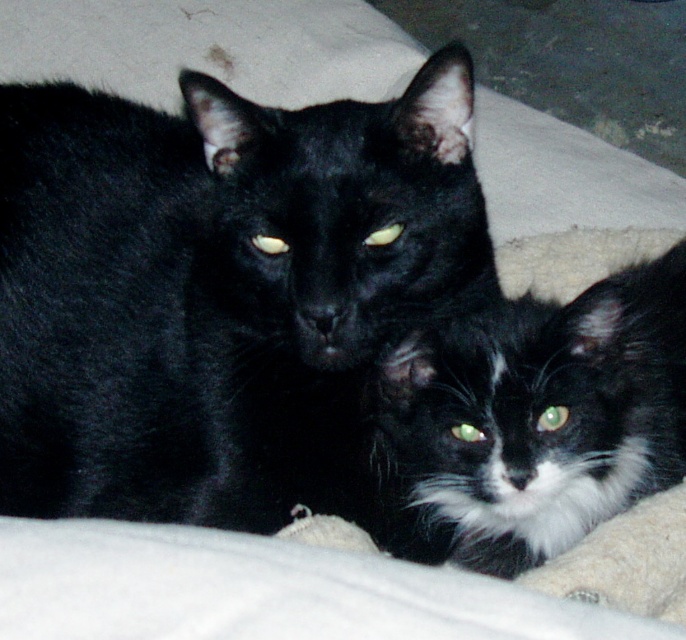
Question: Does black fur cat at center have a lesser width compared to black fluffy cat at center?

Choices:
 (A) yes
 (B) no

Answer: (B)

Question: Which point appears closest to the camera in this image?

Choices:
 (A) (670, 476)
 (B) (189, 490)

Answer: (B)

Question: Which point appears farthest from the camera in this image?

Choices:
 (A) (606, 458)
 (B) (36, 369)

Answer: (B)

Question: Is black fur cat at center thinner than black fluffy cat at center?

Choices:
 (A) no
 (B) yes

Answer: (A)

Question: Observing the image, what is the correct spatial positioning of black fur cat at center in reference to black fluffy cat at center?

Choices:
 (A) left
 (B) right

Answer: (A)